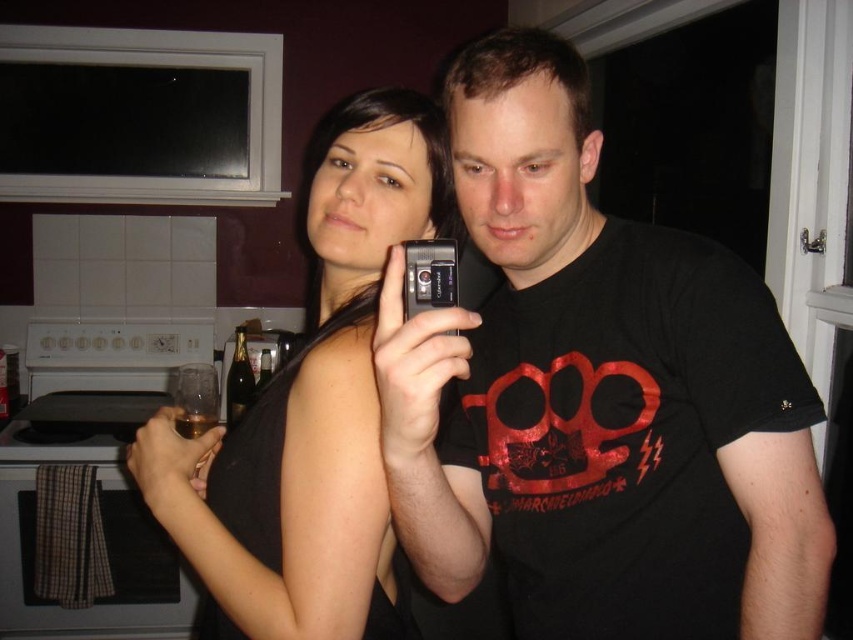
Looking at this image, you are standing in the kitchen and want to take a selfie with two friends. You notice two specific points marked as point 1 at coordinates (x=393, y=513) and point 2 at (x=341, y=596). Which point should you stand closer to if you want to be in the foreground of the photo?

You should stand closer to point 1 at coordinates (x=393, y=513) because it is in front of point 2 at (x=341, y=596), making it closer to the camera and thus appearing in the foreground.